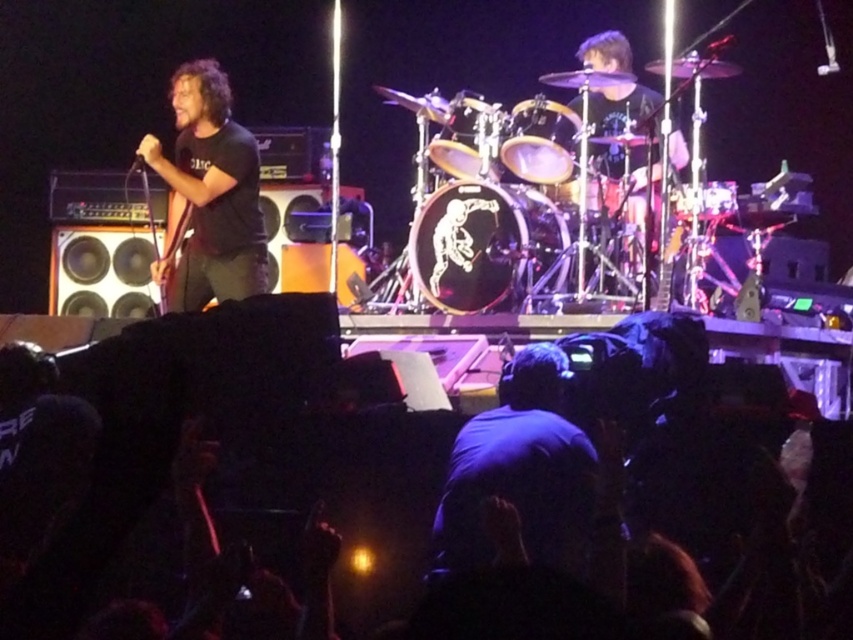
Question: Based on their relative distances, which object is farther from the black matte shirt at left?

Choices:
 (A) black drum at center
 (B) shiny silver drum at center
 (C) shiny gold drum at center
 (D) shiny black drum at center

Answer: (D)

Question: Does black matte shirt at left appear under shiny black drum set at center?

Choices:
 (A) no
 (B) yes

Answer: (B)

Question: Does shiny black drum set at center have a greater width compared to shiny black drum at center?

Choices:
 (A) yes
 (B) no

Answer: (A)

Question: Among these objects, which one is farthest from the camera?

Choices:
 (A) shiny black drum set at center
 (B) black glossy drum at center
 (C) black fabric crowd at lower center

Answer: (B)

Question: Is shiny black drum set at center to the right of black drum at center from the viewer's perspective?

Choices:
 (A) no
 (B) yes

Answer: (B)

Question: Which of the following is the farthest from the observer?

Choices:
 (A) (682, 204)
 (B) (48, 563)
 (C) (556, 157)
 (D) (486, 150)

Answer: (A)